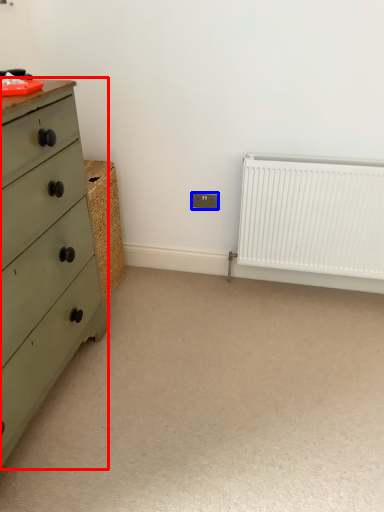
Question: Which of the following is the farthest to the observer, chest of drawers (highlighted by a red box) or electric outlet (highlighted by a blue box)?

Choices:
 (A) chest of drawers
 (B) electric outlet

Answer: (B)